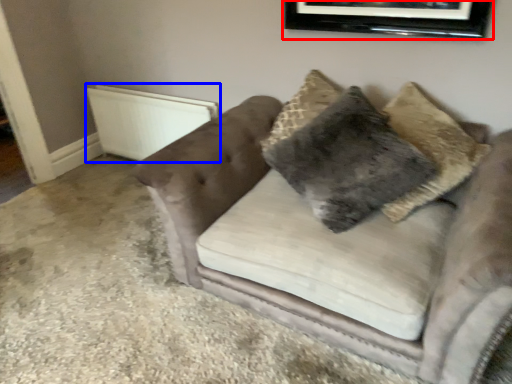
Question: Which of the following is the closest to the observer, picture frame (highlighted by a red box) or radiator (highlighted by a blue box)?

Choices:
 (A) picture frame
 (B) radiator

Answer: (A)